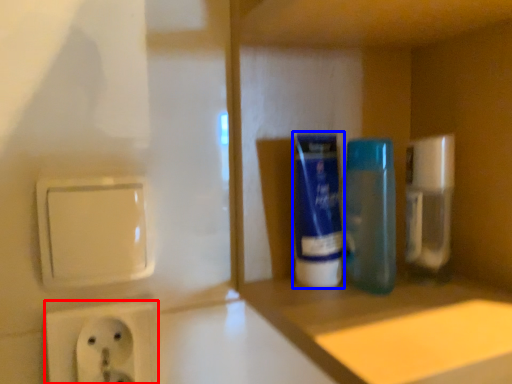
Question: Which point is closer to the camera, power plugs and sockets (highlighted by a red box) or mouthwash (highlighted by a blue box)?

Choices:
 (A) power plugs and sockets
 (B) mouthwash

Answer: (A)